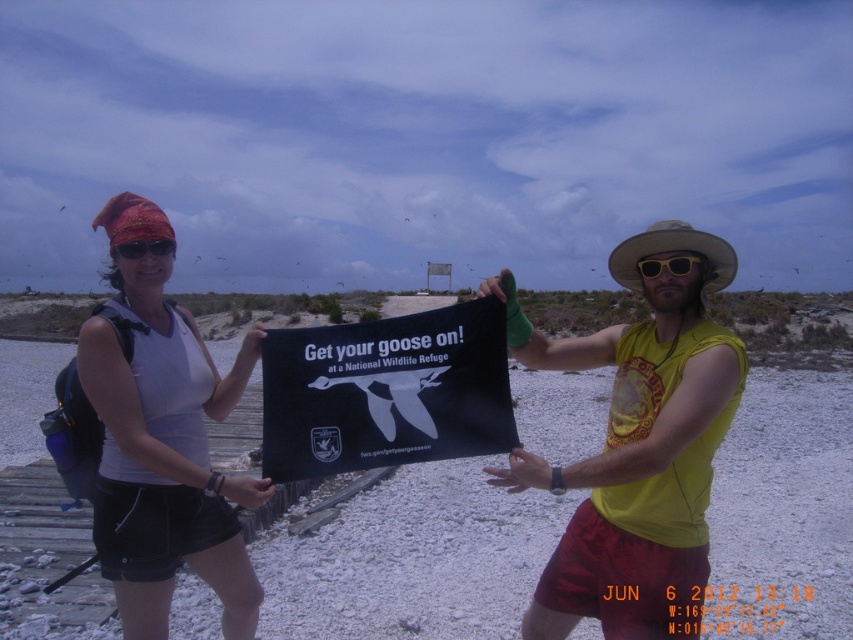
You are a photographer trying to capture both the white fabric at center and the black fabric sign at center in the same frame. Based on their heights, which one will appear taller in your photo?

The white fabric at center will appear taller in the photo since it has a greater height compared to the black fabric sign at center.

You are a photographer wanting to capture both the yellow sleeveless shirt at center and the white fabric at center in the same frame. Given that your camera has a maximum focal length that allows capturing objects up to 7 feet apart, will you be able to include both in your shot?

The yellow sleeveless shirt at center and white fabric at center are 7.10 feet apart, which exceeds the camera maximum focal length of 7 feet. So you cannot include both in the same frame.

You are a photographer trying to capture both the black fabric sign at center and the yellow plastic goggles at center in a single frame. Which object should you focus on first to ensure both are in the frame?

The black fabric sign at center is larger in size than the yellow plastic goggles at center, so focusing on the larger object first will help ensure both fit within the frame.